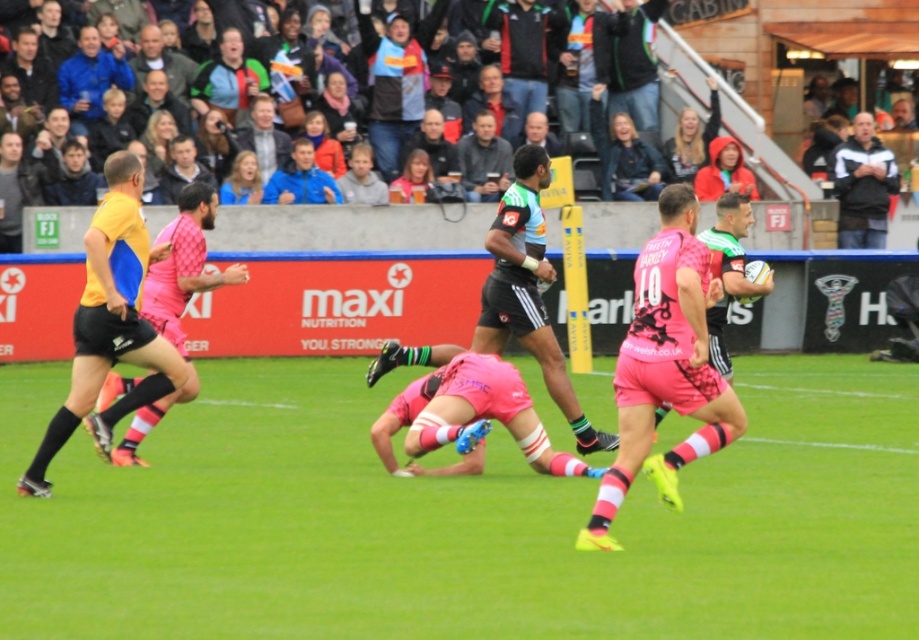
You are a referee observing the rugby match. You notice two players wearing yellow matte shorts at left and matte yellow shorts at left. Which player has wider shorts?

The yellow matte shorts at left are narrower than matte yellow shorts at left, so the matte yellow shorts at left are wider.

You are a referee watching the rugby match. You notice two points marked on the field at coordinates point (868, 125) and point (485, 141). Which point is closer to the front of the pitch where the action is happening?

Point (868, 125) is further to the viewer than point (485, 141), so the point closer to the front of the pitch where the action is happening is point (485, 141).